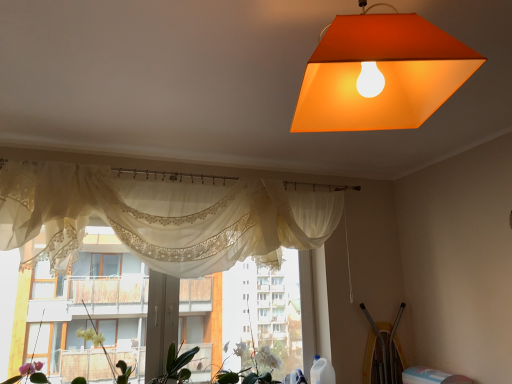
Question: Is white matte plant at center, the 1th plant viewed from the right, positioned behind sheer white curtain at center?

Choices:
 (A) yes
 (B) no

Answer: (A)

Question: Is white matte plant at center, placed as the 3th plant when sorted from left to right, located outside sheer white curtain at center?

Choices:
 (A) yes
 (B) no

Answer: (A)

Question: From a real-world perspective, is white matte plant at center, placed as the 3th plant when sorted from left to right, physically below sheer white curtain at center?

Choices:
 (A) yes
 (B) no

Answer: (A)

Question: Is white matte plant at center, placed as the 3th plant when sorted from left to right, not close to sheer white curtain at center?

Choices:
 (A) no
 (B) yes

Answer: (A)

Question: Considering the relative positions of white matte plant at center, placed as the 3th plant when sorted from left to right, and sheer white curtain at center in the image provided, is white matte plant at center, placed as the 3th plant when sorted from left to right, in front of sheer white curtain at center?

Choices:
 (A) no
 (B) yes

Answer: (A)

Question: Is white matte plant at center, the 1th plant viewed from the right, at the left side of sheer white curtain at center?

Choices:
 (A) yes
 (B) no

Answer: (B)

Question: From a real-world perspective, is sheer white curtain at center below sheer lace curtains at center?

Choices:
 (A) no
 (B) yes

Answer: (A)

Question: Does sheer white curtain at center have a lesser width compared to sheer lace curtains at center?

Choices:
 (A) no
 (B) yes

Answer: (A)

Question: Is sheer white curtain at center facing towards sheer lace curtains at center?

Choices:
 (A) yes
 (B) no

Answer: (B)

Question: From a real-world perspective, is sheer white curtain at center on sheer lace curtains at center?

Choices:
 (A) no
 (B) yes

Answer: (B)

Question: Does sheer white curtain at center have a greater height compared to sheer lace curtains at center?

Choices:
 (A) no
 (B) yes

Answer: (A)

Question: Can you confirm if sheer white curtain at center is bigger than sheer lace curtains at center?

Choices:
 (A) yes
 (B) no

Answer: (A)

Question: Is sheer white curtain at center outside green leafy plant at center, the first plant when ordered from left to right?

Choices:
 (A) yes
 (B) no

Answer: (A)